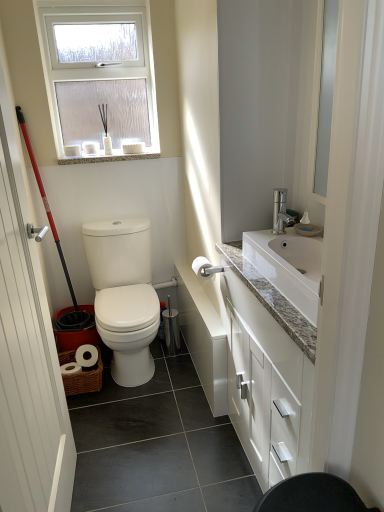
Question: Considering the relative sizes of white glossy cabinet at right and white frosted glass window at upper center in the image provided, is white glossy cabinet at right wider than white frosted glass window at upper center?

Choices:
 (A) yes
 (B) no

Answer: (A)

Question: From the image's perspective, is white glossy cabinet at right located beneath white frosted glass window at upper center?

Choices:
 (A) no
 (B) yes

Answer: (B)

Question: Is white glossy cabinet at right far away from white frosted glass window at upper center?

Choices:
 (A) yes
 (B) no

Answer: (A)

Question: Can you confirm if white glossy cabinet at right is thinner than white frosted glass window at upper center?

Choices:
 (A) yes
 (B) no

Answer: (B)

Question: Does white glossy cabinet at right lie behind white frosted glass window at upper center?

Choices:
 (A) no
 (B) yes

Answer: (A)

Question: Does white glossy cabinet at right touch white frosted glass window at upper center?

Choices:
 (A) yes
 (B) no

Answer: (B)

Question: Is white wooden door at left oriented away from white frosted glass window at upper center?

Choices:
 (A) no
 (B) yes

Answer: (A)

Question: Is white wooden door at left in front of white frosted glass window at upper center?

Choices:
 (A) yes
 (B) no

Answer: (A)

Question: Is white wooden door at left shorter than white frosted glass window at upper center?

Choices:
 (A) no
 (B) yes

Answer: (A)

Question: Is white wooden door at left taller than white frosted glass window at upper center?

Choices:
 (A) no
 (B) yes

Answer: (B)

Question: From a real-world perspective, is white wooden door at left beneath white frosted glass window at upper center?

Choices:
 (A) no
 (B) yes

Answer: (B)

Question: From the image's perspective, is white wooden door at left located above white frosted glass window at upper center?

Choices:
 (A) no
 (B) yes

Answer: (A)

Question: From the image's perspective, is white matte toilet paper at center beneath white wooden door at left?

Choices:
 (A) yes
 (B) no

Answer: (B)